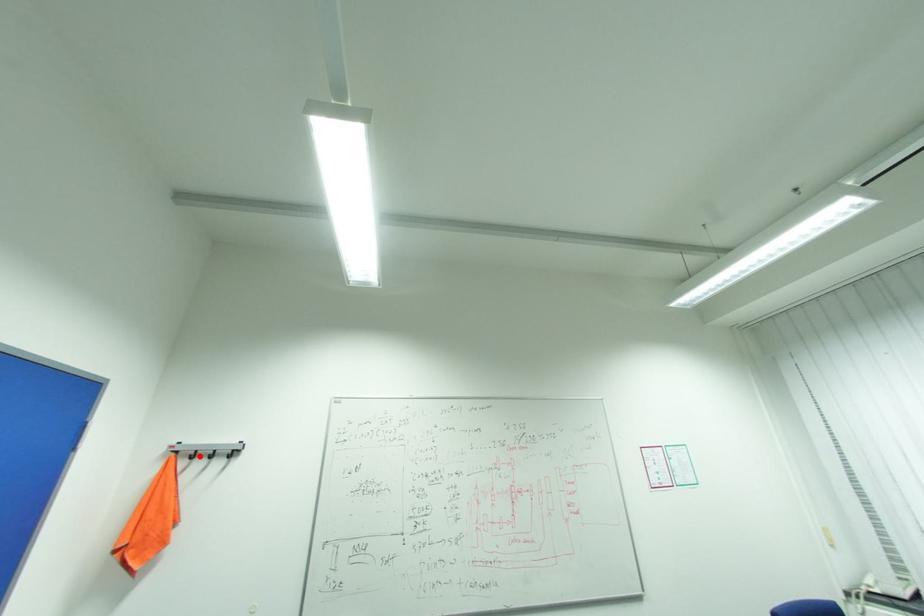
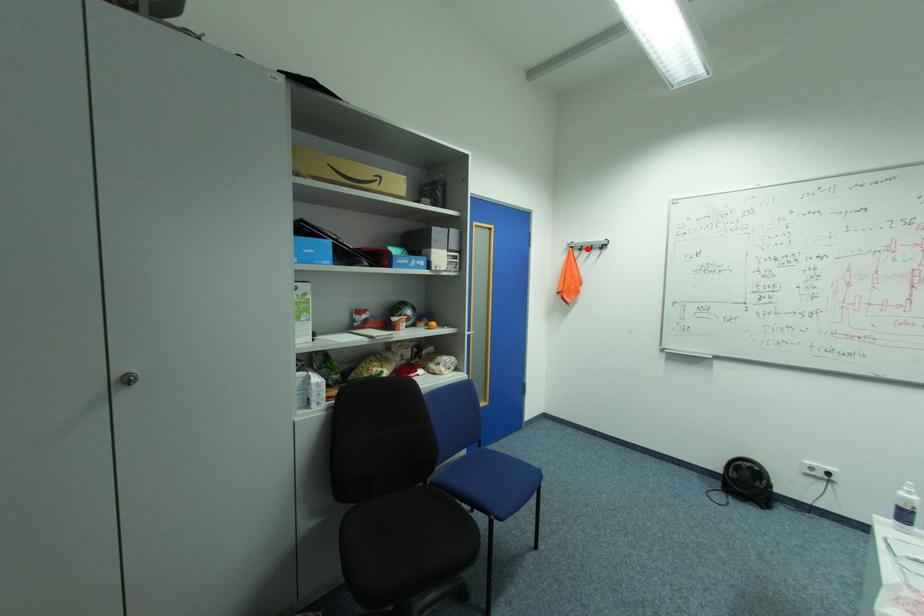
I am providing you with two images of the same scene from different viewpoints. A red point is marked on the first image and another point is marked on the second image. Do the highlighted points in image1 and image2 indicate the same real-world spot?

Yes